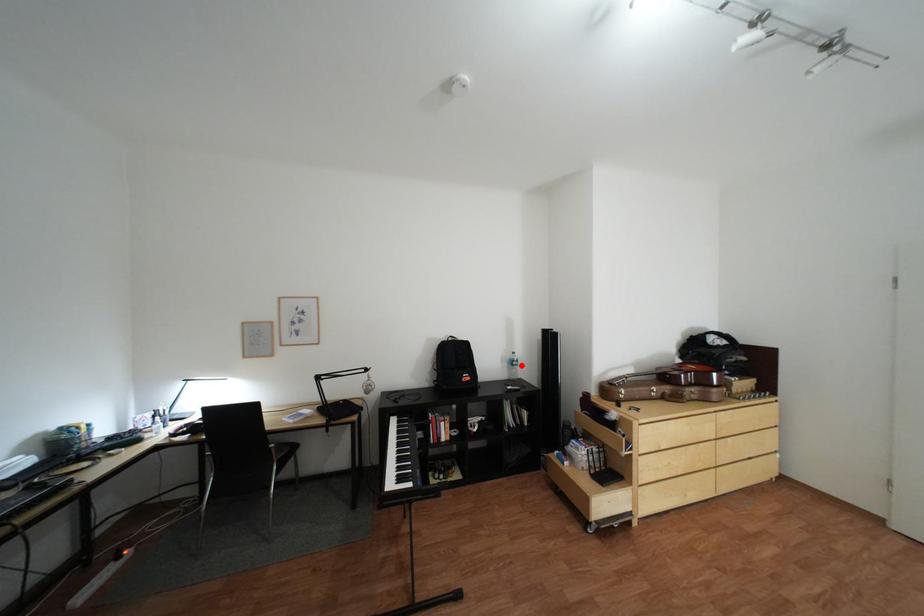
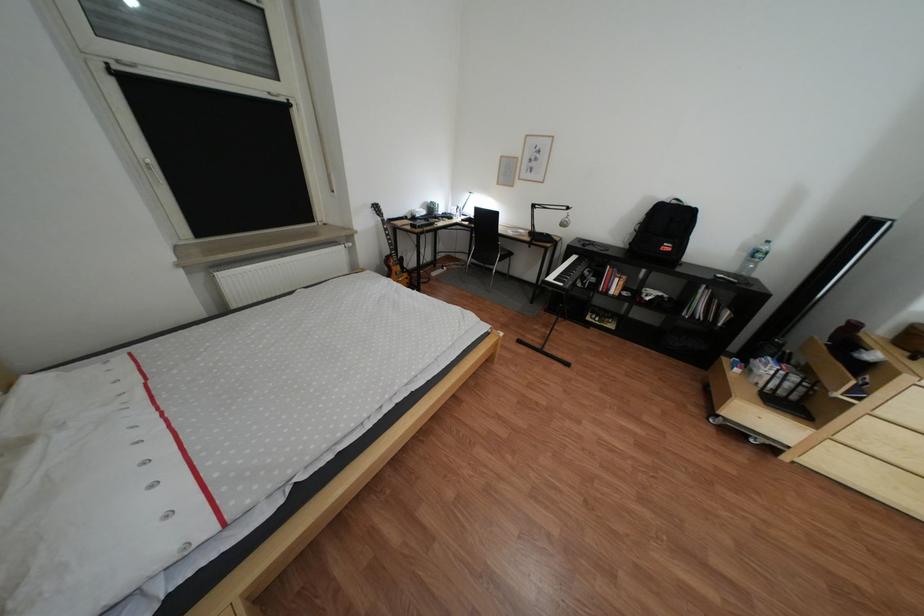
Question: I am providing you with two images of the same scene from different viewpoints. Image1 has a red point marked. In image2, the corresponding 3D location appears at what relative position? Reply with the corresponding letter.

Choices:
 (A) Closer
 (B) Farther

Answer: (A)